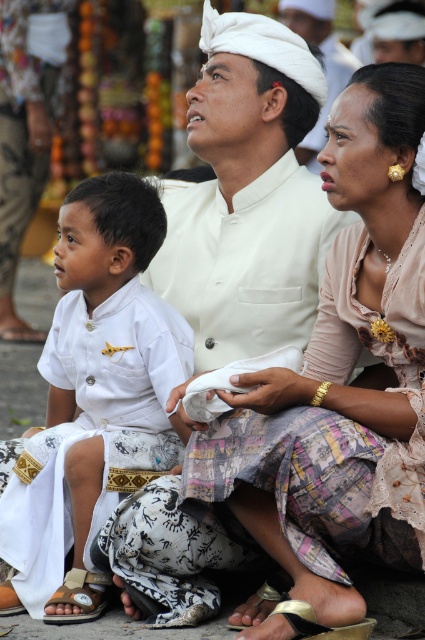
You are a photographer trying to capture the family in this scene. You notice two points of interest marked as point A and point B. If point A is at coordinate point (413, 442) and point B is at coordinate point (65, 602), which point is closer to the camera based on their positions?

Point A at coordinate point (413, 442) is in front of point B at coordinate point (65, 602), so point A is closer to the camera.

You are a photographer standing at the scene. You want to capture a closeup shot of the matte white dress at center. Given that your camera can focus up to 10 meters, will you be able to capture the dress clearly?

The matte white dress at center is 14.33 meters away from the camera, which is beyond the camera focus range of 10 meters. Therefore, you cannot capture the dress clearly.